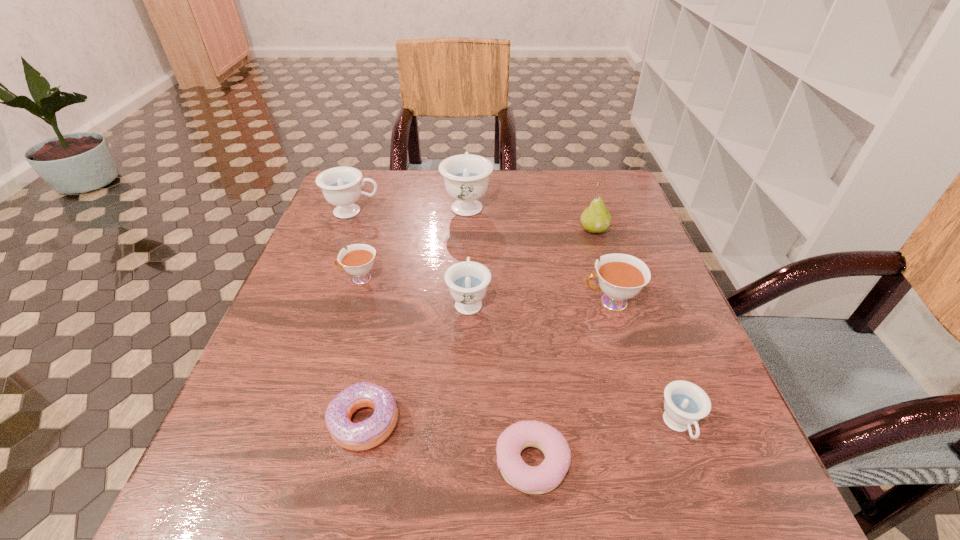
At what (x,y) coordinates should I click in order to perform the action: click on vacant space located 0.380m on the left of the pear. Please return your answer as a coordinate pair (x, y). Image resolution: width=960 pixels, height=540 pixels. Looking at the image, I should click on (428, 229).

Image resolution: width=960 pixels, height=540 pixels. In order to click on blank space located 0.400m on the side of the leftmost blue teacup with the handle in this screenshot , I will do `click(533, 212)`.

The width and height of the screenshot is (960, 540). Identify the location of vacant space situated on the side of the bigger white teacup with the handle. (500, 302).

Locate an element on the screen. This screenshot has width=960, height=540. vacant space located 0.320m on the side of the bigger white teacup with the handle is located at coordinates (428, 302).

Find the location of a particular element. The image size is (960, 540). vacant space situated on the side of the bigger white teacup with the handle is located at coordinates tap(558, 302).

Where is `vacant space situated 0.330m on the side of the third farthest blue teacup with the handle`? This screenshot has height=540, width=960. vacant space situated 0.330m on the side of the third farthest blue teacup with the handle is located at coordinates (471, 200).

Locate an element on the screen. vacant space located 0.210m on the side of the third farthest blue teacup with the handle is located at coordinates (470, 226).

At what (x,y) coordinates should I click in order to perform the action: click on free space located on the side of the third farthest blue teacup with the handle. Please return your answer as a coordinate pair (x, y). Image resolution: width=960 pixels, height=540 pixels. Looking at the image, I should click on (470, 250).

The image size is (960, 540). I want to click on vacant region located 0.100m on the side of the smaller white teacup with the handle, so click(294, 279).

The width and height of the screenshot is (960, 540). I want to click on vacant position located on the side of the smaller white teacup with the handle, so click(317, 279).